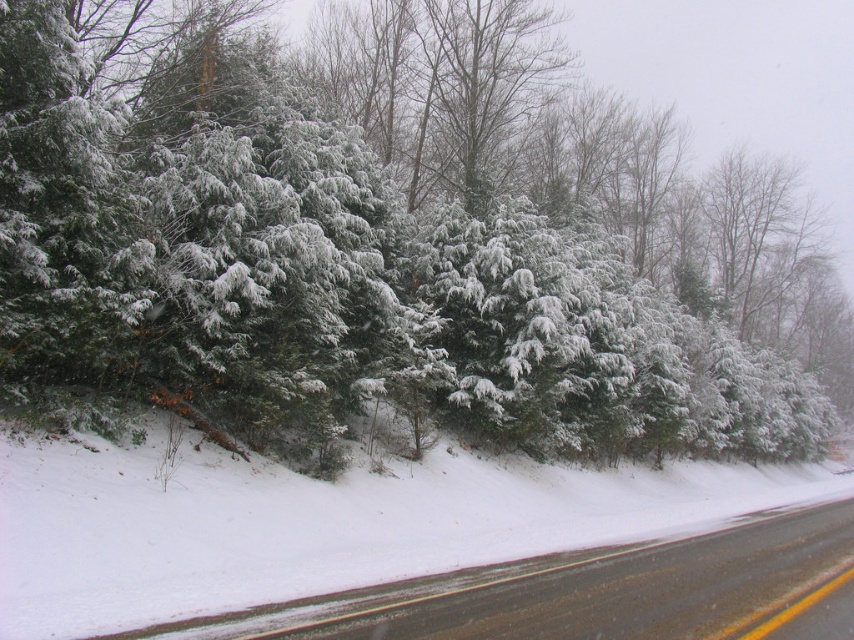
You are standing at the base of the embankment on the left side of the road. You see two points marked on the road ahead of you. Which point is closer to you, point [167,161] or point [196,620]?

Point [196,620] is closer to you because the description states that point [167,161] is behind point [196,620].

You are a delivery truck driver who needs to park your truck on the black asphalt road at lower right. The truck is 3 meters wide. Can you park the truck on the road without overlapping the green matte evergreen trees at upper left?

The green matte evergreen trees at upper left are wider than the black asphalt road at lower right. Since the truck is 3 meters wide, it may not fit on the road if the road is narrower than 3 meters. However, the exact width of the road is not provided, so we cannot definitively determine if the truck can park without overlapping the trees.

You are driving a car and see the green matte evergreen trees at upper left and the black asphalt road at lower right in your view. Which object is closer to you, the driver?

The green matte evergreen trees at upper left are closer to you than the black asphalt road at lower right because the road is positioned behind the trees.